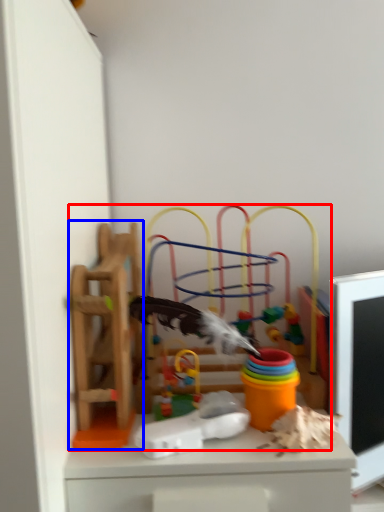
Question: Among these objects, which one is farthest to the camera, toy (highlighted by a red box) or toy (highlighted by a blue box)?

Choices:
 (A) toy
 (B) toy

Answer: (A)